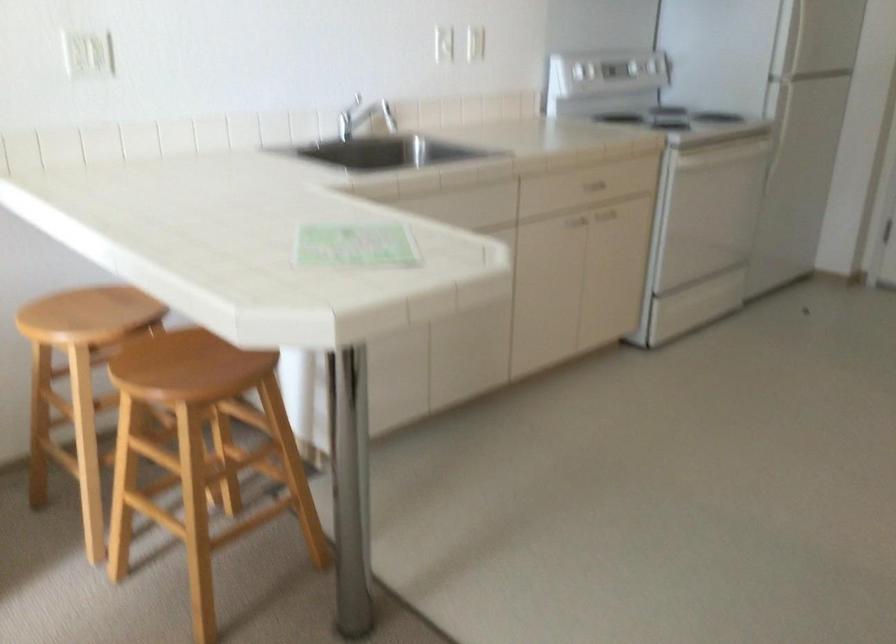
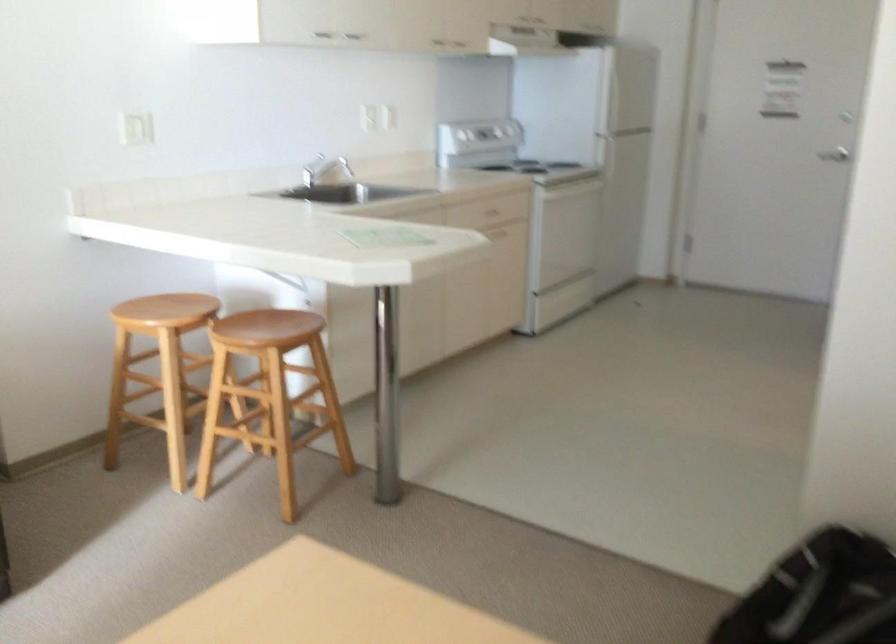
The point at (601, 84) is marked in the first image. Where is the corresponding point in the second image?

(478, 135)